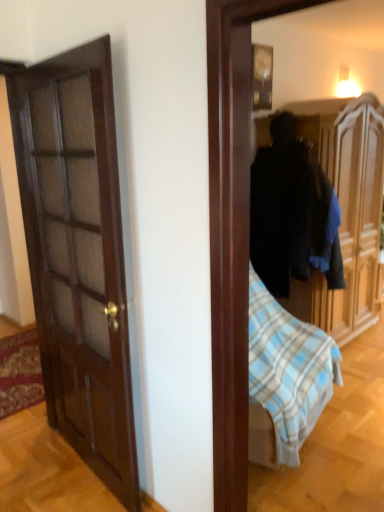
Question: Is point (377, 271) closer or farther from the camera than point (253, 44)?

Choices:
 (A) farther
 (B) closer

Answer: (A)

Question: From a real-world perspective, is wooden wardrobe at center positioned above or below wooden clock at upper center?

Choices:
 (A) below
 (B) above

Answer: (A)

Question: In terms of height, does wooden wardrobe at center look taller or shorter compared to wooden clock at upper center?

Choices:
 (A) tall
 (B) short

Answer: (A)

Question: Is wooden clock at upper center spatially inside wooden wardrobe at center, or outside of it?

Choices:
 (A) outside
 (B) inside

Answer: (A)

Question: From a real-world perspective, is wooden clock at upper center above or below wooden wardrobe at center?

Choices:
 (A) above
 (B) below

Answer: (A)

Question: From the image's perspective, is wooden clock at upper center above or below wooden wardrobe at center?

Choices:
 (A) above
 (B) below

Answer: (A)

Question: In terms of height, does wooden clock at upper center look taller or shorter compared to wooden wardrobe at center?

Choices:
 (A) short
 (B) tall

Answer: (A)